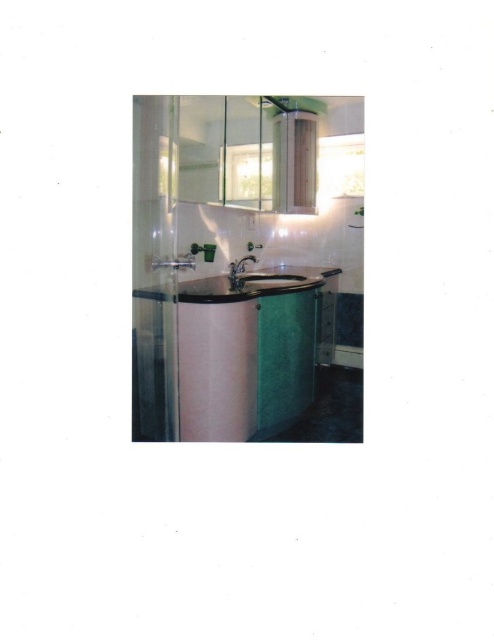
Does green marble counter top at center have a larger size compared to black glossy sink at center?

Correct, green marble counter top at center is larger in size than black glossy sink at center.

The image size is (494, 640). Identify the location of green marble counter top at center. (232, 353).

Between black glossy sink at center and matte white sink at center, which one is positioned lower?

Positioned lower is black glossy sink at center.

Where is `black glossy sink at center`? black glossy sink at center is located at coordinates (243, 284).

Where is `black glossy sink at center`? This screenshot has width=494, height=640. black glossy sink at center is located at coordinates (243, 284).

Is green marble counter top at center to the right of matte white sink at center from the viewer's perspective?

Incorrect, green marble counter top at center is not on the right side of matte white sink at center.

Does green marble counter top at center lie behind matte white sink at center?

That is False.

Where is `green marble counter top at center`? Image resolution: width=494 pixels, height=640 pixels. green marble counter top at center is located at coordinates (232, 353).